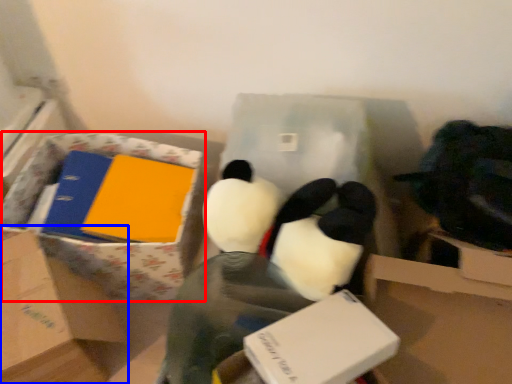
Question: Which point is closer to the camera, cardboard box (highlighted by a red box) or box (highlighted by a blue box)?

Choices:
 (A) cardboard box
 (B) box

Answer: (B)